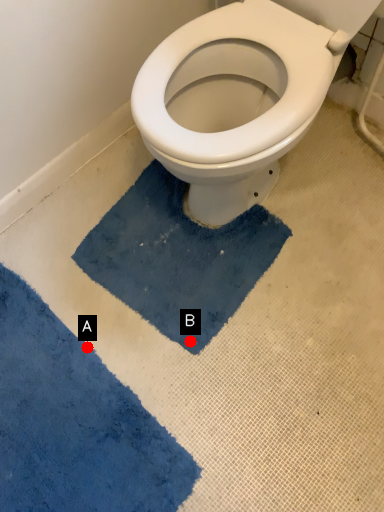
Question: Two points are circled on the image, labeled by A and B beside each circle. Among these points, which one is farthest from the camera?

Choices:
 (A) A is further
 (B) B is further

Answer: (A)